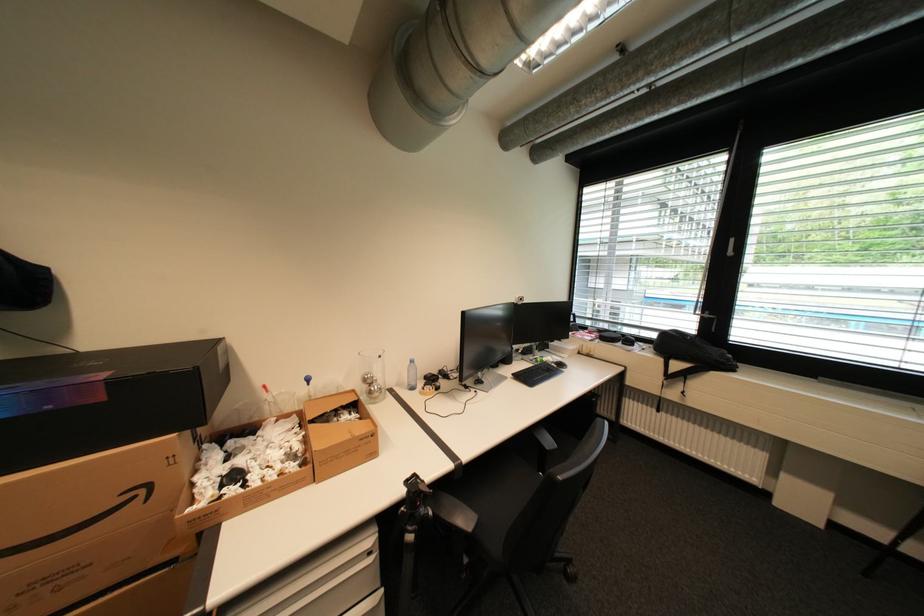
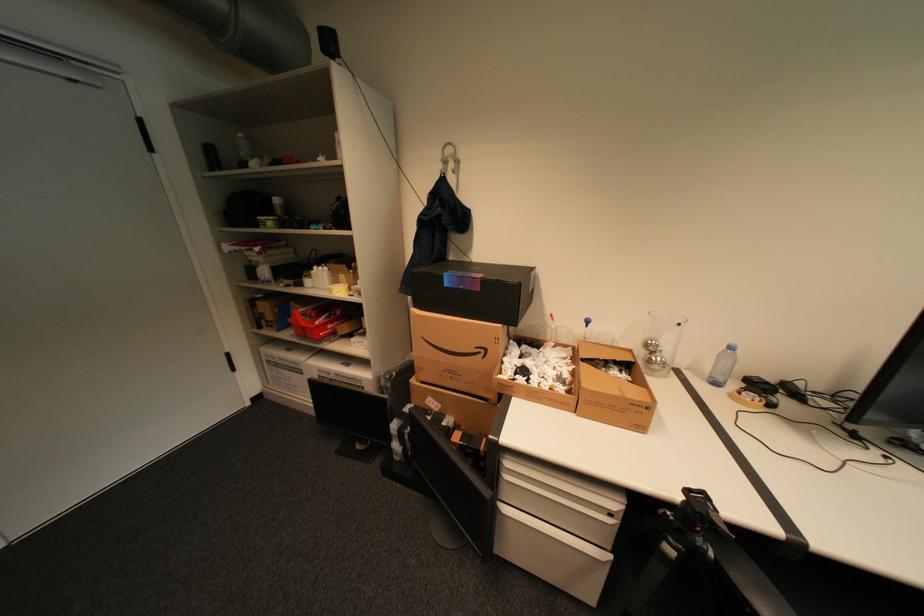
Question: The images are taken continuously from a first-person perspective. In which direction is your viewpoint rotating?

Choices:
 (A) Left
 (B) Right
 (C) Up
 (D) Down

Answer: (A)